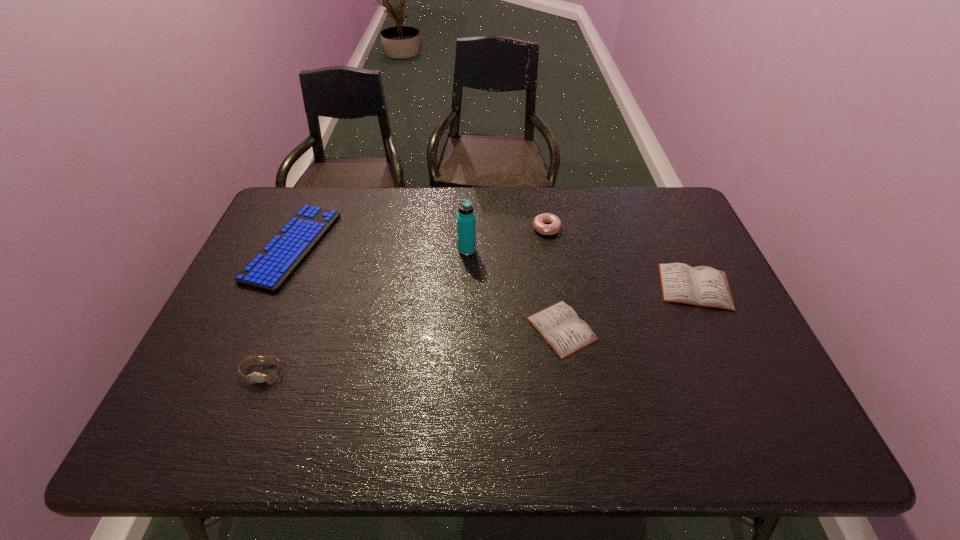
This screenshot has height=540, width=960. What are the coordinates of `vacant space located on the back of the rightmost object` in the screenshot? It's located at (658, 205).

Where is `free spot located 0.060m on the back of the computer keyboard`? Image resolution: width=960 pixels, height=540 pixels. free spot located 0.060m on the back of the computer keyboard is located at coordinates (314, 198).

At what (x,y) coordinates should I click in order to perform the action: click on free space located 0.170m on the left of the water bottle. Please return your answer as a coordinate pair (x, y). Looking at the image, I should click on (402, 250).

At what (x,y) coordinates should I click in order to perform the action: click on vacant space situated on the back of the doughnut. Please return your answer as a coordinate pair (x, y). The width and height of the screenshot is (960, 540). Looking at the image, I should click on (541, 199).

This screenshot has height=540, width=960. I want to click on computer keyboard present at the far edge, so click(x=273, y=266).

Where is `doughnut that is at the far edge`? Image resolution: width=960 pixels, height=540 pixels. doughnut that is at the far edge is located at coordinates click(553, 227).

Find the location of a particular element. This screenshot has width=960, height=540. object that is positioned at the near edge is located at coordinates [256, 377].

Where is `computer keyboard that is at the left edge`? computer keyboard that is at the left edge is located at coordinates click(x=273, y=266).

Locate an element on the screen. watch at the left edge is located at coordinates (256, 377).

You are a GUI agent. You are given a task and a screenshot of the screen. Output one action in this format:
    pyautogui.click(x=<x>, y=<y>)
    Task: Click on the object positioned at the right edge
    The width and height of the screenshot is (960, 540).
    Given the screenshot: What is the action you would take?
    pyautogui.click(x=703, y=286)